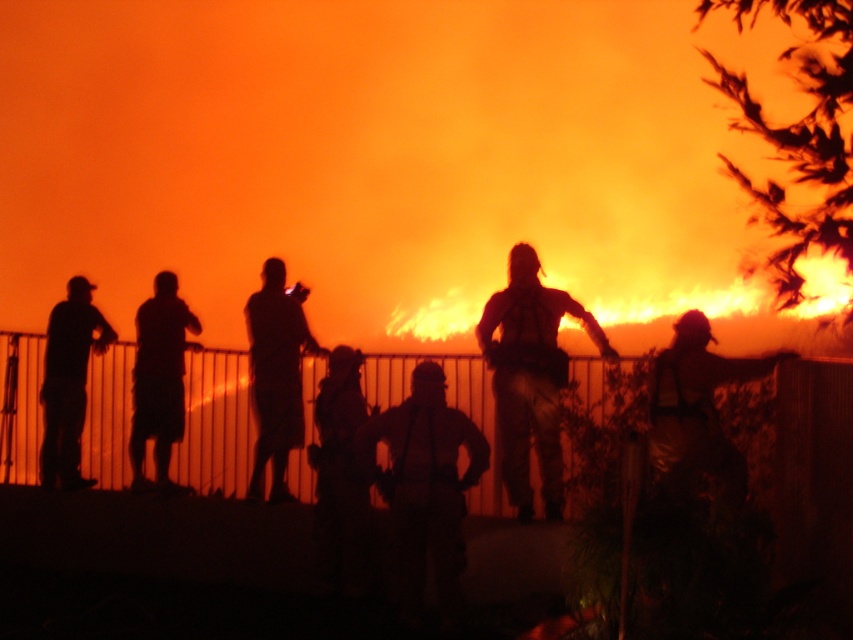
You are a firefighter trying to assess the situation. You notice a dark brown leather jacket at center and a dark matte shorts at left. Which item is nearer to you?

The dark brown leather jacket at center is closer to the viewer than the dark matte shorts at left.

Looking at this image, you are standing at the center of the image and want to locate the dark brown leather jacket at center. According to the coordinates provided, is it closer to the top or the bottom of the image?

The dark brown leather jacket at center is located at coordinates point (531, 376). Since the y coordinate is 0.623, which is closer to 0.5 than to 1, it is closer to the center vertically. However, since the question asks whether it is closer to the top or bottom, the midpoint between top and bottom is 0.5. The distance from 0.623 to 0.5 is 0.123, and the distance to the bottom is 0.623. Since 0.123 is less than 0.623, it is closer to the center. Wait, but the question is top or bottom. Let me recast. If

Based on the photo, you are a firefighter trying to see the fire through the smoke. You notice the dark brown uniform at center and the metallic gold helmet at center. Which object takes up more space in your view?

The metallic gold helmet at center takes up more space in your view because it is larger than the dark brown uniform at center.